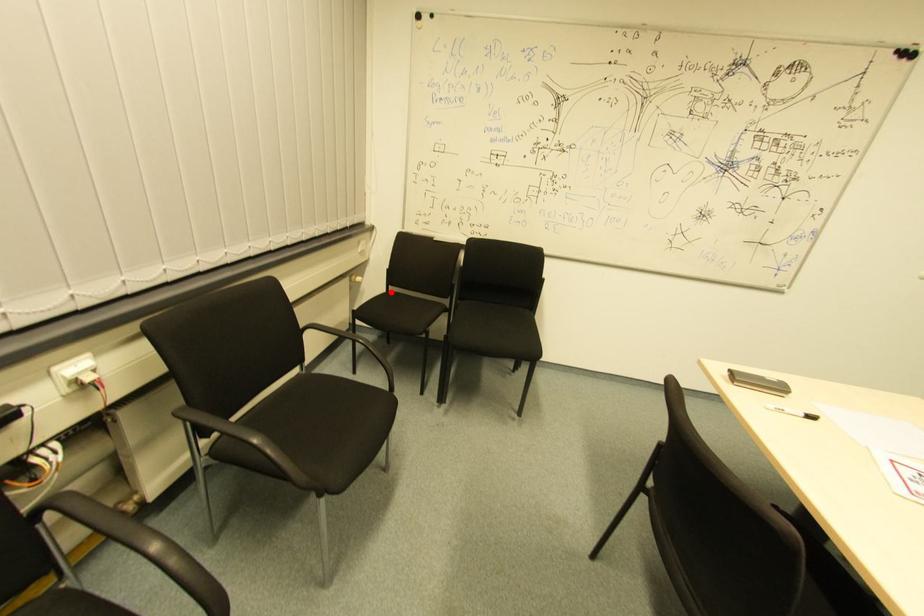
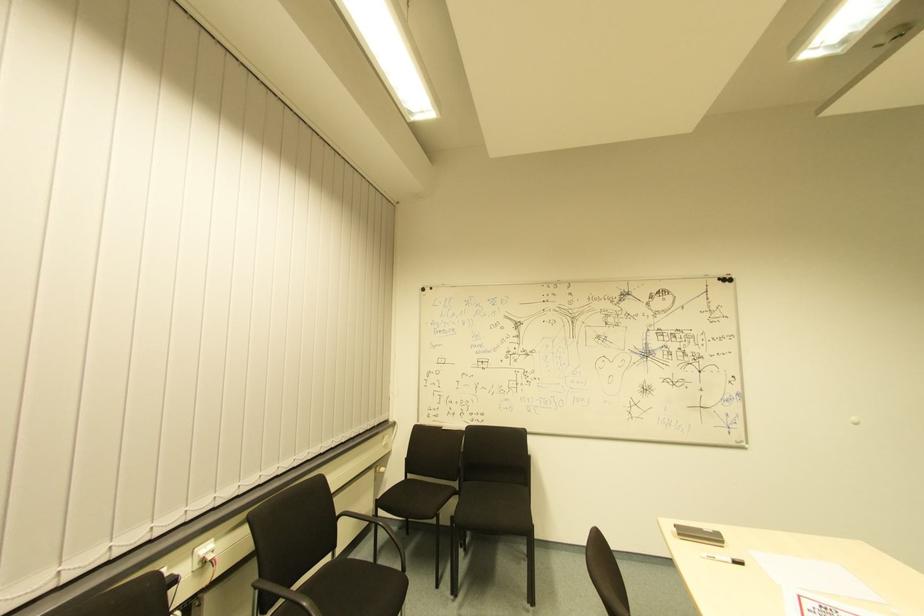
Where in the second image is the point corresponding to the highlighted location from the first image?

(408, 479)